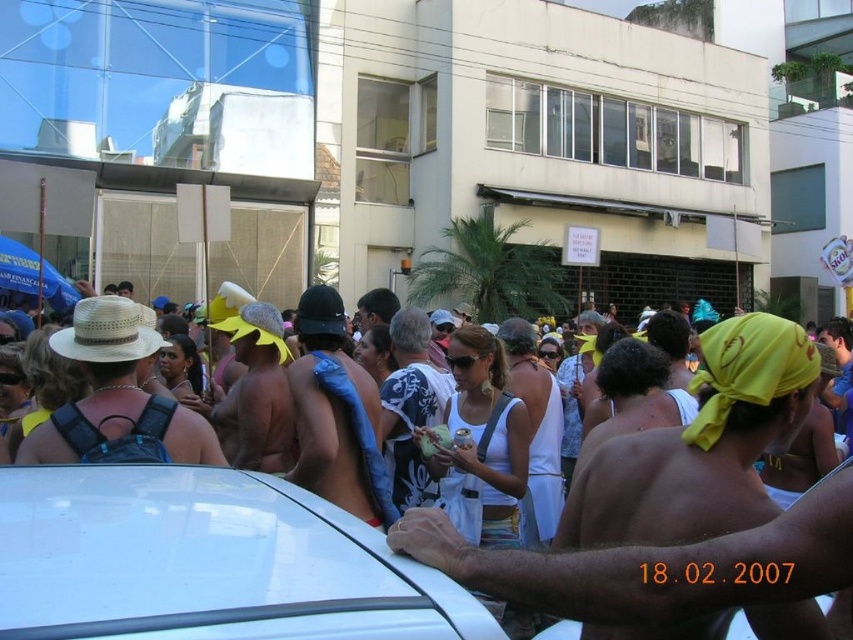
You are a photographer standing in the crowd at the carnival. You want to take a photo of both the white glossy car at lower left and the white printed shirt at center. Which object should you focus on first to ensure it appears larger in your photo?

The white glossy car at lower left is closer to the viewer than the white printed shirt at center, so focusing on it first will make it appear larger in the photo.

You are a photographer positioned in the crowd at the carnival. You want to take a photo of both the white glossy car at lower left and the blue fabric at center. Which object should you focus on first to ensure it appears larger in your photo?

The white glossy car at lower left is closer to the viewer than the blue fabric at center, so focusing on it first will make it appear larger in the photo.